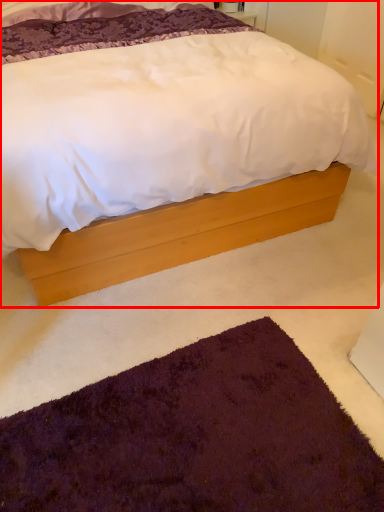
Question: From the image's perspective, considering the relative positions of bed (annotated by the red box) and doormat in the image provided, where is bed (annotated by the red box) located with respect to the staircase?

Choices:
 (A) below
 (B) above

Answer: (B)